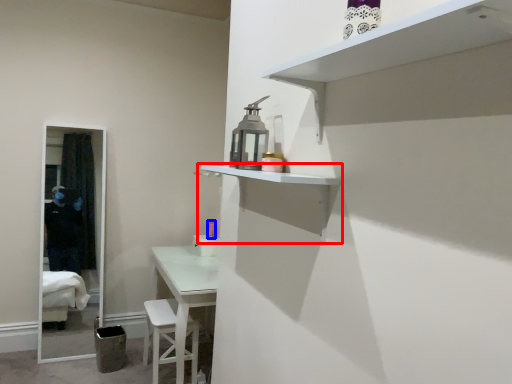
Question: Which object is further to the camera taking this photo, shelf (highlighted by a red box) or toiletry (highlighted by a blue box)?

Choices:
 (A) shelf
 (B) toiletry

Answer: (B)